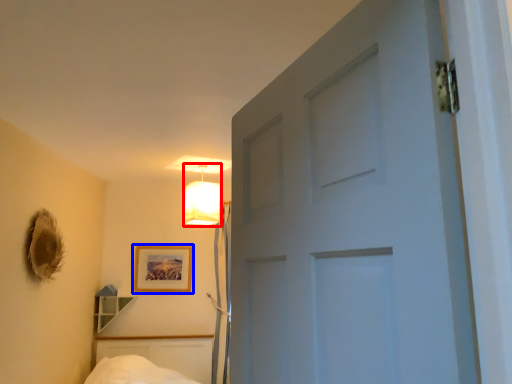
Question: Which point is closer to the camera, lamp (highlighted by a red box) or picture frame (highlighted by a blue box)?

Choices:
 (A) lamp
 (B) picture frame

Answer: (A)